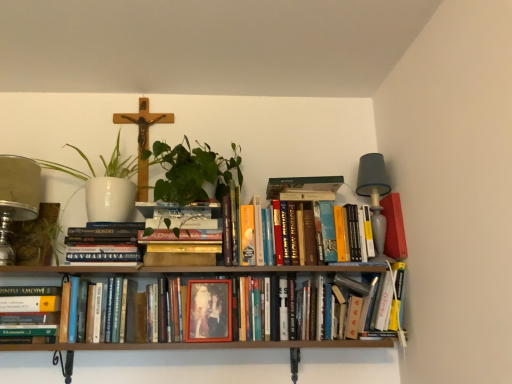
The image size is (512, 384). What do you see at coordinates (103, 242) in the screenshot? I see `hardcover books at center, the third book viewed from the right` at bounding box center [103, 242].

Where is `hardcover books at center, marked as the 2th book in a left-to-right arrangement`? The image size is (512, 384). hardcover books at center, marked as the 2th book in a left-to-right arrangement is located at coordinates (103, 242).

What do you see at coordinates (105, 185) in the screenshot?
I see `white ceramic pot at upper left` at bounding box center [105, 185].

This screenshot has height=384, width=512. What do you see at coordinates (375, 197) in the screenshot?
I see `gray fabric lampshade at upper right, marked as the 1th table lamp in a right-to-left arrangement` at bounding box center [375, 197].

Identify the location of metallic glass table lamp at left, the first table lamp from the left. This screenshot has height=384, width=512. (17, 198).

Where is `hardcover books at center, marked as the 2th book in a left-to-right arrangement`? The width and height of the screenshot is (512, 384). hardcover books at center, marked as the 2th book in a left-to-right arrangement is located at coordinates (103, 242).

From the image's perspective, is matte plastic photo frame at center, which is counted as the 2th paperback book, starting from the back, above gray fabric lampshade at upper right, marked as the 1th table lamp in a right-to-left arrangement?

No.

Is matte plastic photo frame at center, placed as the 1th paperback book when sorted from bottom to top, beside gray fabric lampshade at upper right, marked as the 1th table lamp in a right-to-left arrangement?

No.

Considering the sizes of objects matte plastic photo frame at center, marked as the 1th paperback book in a front-to-back arrangement, and gray fabric lampshade at upper right, marked as the 1th table lamp in a right-to-left arrangement, in the image provided, who is smaller, matte plastic photo frame at center, marked as the 1th paperback book in a front-to-back arrangement, or gray fabric lampshade at upper right, marked as the 1th table lamp in a right-to-left arrangement,?

matte plastic photo frame at center, marked as the 1th paperback book in a front-to-back arrangement.

Is matte plastic photo frame at center, placed as the first paperback book when sorted from left to right, oriented towards gray fabric lampshade at upper right, arranged as the 2th table lamp when viewed from the left?

No.

From the picture: Is hardcover book at lower left, acting as the 1th book starting from the left, with hardcover books at center, the third book viewed from the right?

They are not placed beside each other.

Can you confirm if hardcover book at lower left, acting as the 1th book starting from the left, is taller than hardcover books at center, marked as the 2th book in a left-to-right arrangement?

In fact, hardcover book at lower left, acting as the 1th book starting from the left, may be shorter than hardcover books at center, marked as the 2th book in a left-to-right arrangement.

From a real-world perspective, is hardcover book at lower left, acting as the fourth book starting from the right, above or below hardcover books at center, the third book viewed from the right?

From a real-world perspective, hardcover book at lower left, acting as the fourth book starting from the right, is physically below hardcover books at center, the third book viewed from the right.

Which is in front, wooden crucifix at upper center or matte red paperback book at right, the 1th paperback book viewed from the top?

Positioned in front is matte red paperback book at right, the 1th paperback book viewed from the top.

Is wooden crucifix at upper center shorter than matte red paperback book at right, which is the 2th paperback book in bottom-to-top order?

In fact, wooden crucifix at upper center may be taller than matte red paperback book at right, which is the 2th paperback book in bottom-to-top order.

Is point (172, 120) farther from viewer compared to point (404, 238)?

Yes, it is behind point (404, 238).

Find the location of a particular element. The height and width of the screenshot is (384, 512). the 1st paperback book directly beneath the wooden crucifix at upper center (from a real-world perspective) is located at coordinates (394, 227).

From the image's perspective, starting from the matte plastic photo frame at center, which ranks as the second paperback book in right-to-left order, which book is the 2nd one below? Please provide its 2D coordinates.

[(29, 314)]

Is matte plastic photo frame at center, the second paperback book viewed from the top, turned away from hardcover book at lower left, acting as the fourth book starting from the right?

No, hardcover book at lower left, acting as the fourth book starting from the right, is not at the back of matte plastic photo frame at center, the second paperback book viewed from the top.

From the image's perspective, between matte plastic photo frame at center, placed as the first paperback book when sorted from left to right, and hardcover book at lower left, acting as the fourth book starting from the right, who is located below?

hardcover book at lower left, acting as the fourth book starting from the right, from the image's perspective.

From a real-world perspective, which object rests below the other?

hardcover book at lower left, acting as the 1th book starting from the left.

Starting from the metallic glass table lamp at left, which ranks as the second table lamp in right-to-left order, which book is the 2nd one behind? Please provide its 2D coordinates.

[(252, 233)]

Is hardcover books at center, marked as the first book in a right-to-left arrangement, positioned far away from metallic glass table lamp at left, which ranks as the second table lamp in right-to-left order?

No, hardcover books at center, marked as the first book in a right-to-left arrangement, is not far away from metallic glass table lamp at left, which ranks as the second table lamp in right-to-left order.

Is hardcover books at center, which is the fourth book from left to right, facing away from metallic glass table lamp at left, the first table lamp from the left?

hardcover books at center, which is the fourth book from left to right, is not turned away from metallic glass table lamp at left, the first table lamp from the left.

Which is in front, point (392, 202) or point (19, 199)?

The point (19, 199) is closer to the camera.

Between matte red paperback book at right, acting as the first paperback book starting from the right, and metallic glass table lamp at left, the first table lamp from the left, which one has smaller size?

matte red paperback book at right, acting as the first paperback book starting from the right.

Is matte red paperback book at right, which ranks as the 1th paperback book in back-to-front order, turned away from metallic glass table lamp at left, which ranks as the second table lamp in right-to-left order?

No, matte red paperback book at right, which ranks as the 1th paperback book in back-to-front order, is not facing away from metallic glass table lamp at left, which ranks as the second table lamp in right-to-left order.

Considering the sizes of objects wooden crucifix at upper center and hardcover books at center, marked as the 2th book in a left-to-right arrangement, in the image provided, who is bigger, wooden crucifix at upper center or hardcover books at center, marked as the 2th book in a left-to-right arrangement,?

hardcover books at center, marked as the 2th book in a left-to-right arrangement, is bigger.

From the picture: Is wooden crucifix at upper center oriented away from hardcover books at center, marked as the 2th book in a left-to-right arrangement?

wooden crucifix at upper center does not have its back to hardcover books at center, marked as the 2th book in a left-to-right arrangement.

Considering the positions of objects wooden crucifix at upper center and hardcover books at center, the third book viewed from the right, in the image provided, who is more to the right, wooden crucifix at upper center or hardcover books at center, the third book viewed from the right,?

Positioned to the right is wooden crucifix at upper center.

Who is taller, wooden crucifix at upper center or hardcover books at center, marked as the 2th book in a left-to-right arrangement?

With more height is wooden crucifix at upper center.

In order to click on table lamp located behind the matte plastic photo frame at center, the second paperback book viewed from the top in this screenshot , I will do `click(375, 197)`.

Locate an element on the screen. This screenshot has width=512, height=384. the 2nd book below when counting from the hardcover books at center, marked as the 2th book in a left-to-right arrangement (from the image's perspective) is located at coordinates (29, 314).

Which object lies further to the anchor point hardcover book at lower left, acting as the fourth book starting from the right, hardcover books at center, marked as the 2th book in a left-to-right arrangement, or wooden frame photo at center, arranged as the second book when viewed from the right?

wooden frame photo at center, arranged as the second book when viewed from the right.

Which object lies nearer to the anchor point hardcover book at lower left, acting as the 1th book starting from the left, metallic glass table lamp at left, the first table lamp from the left, or matte plastic photo frame at center, placed as the first paperback book when sorted from left to right?

The object closer to hardcover book at lower left, acting as the 1th book starting from the left, is metallic glass table lamp at left, the first table lamp from the left.

From the image, which object appears to be farther from matte plastic photo frame at center, which ranks as the second paperback book in right-to-left order, matte red paperback book at right, the 2th paperback book from the front, or wooden frame photo at center, arranged as the second book when viewed from the right?

The object further to matte plastic photo frame at center, which ranks as the second paperback book in right-to-left order, is matte red paperback book at right, the 2th paperback book from the front.

Estimate the real-world distances between objects in this image. Which object is closer to white ceramic pot at upper left, matte red paperback book at right, the 2th paperback book from the front, or metallic glass table lamp at left, which ranks as the second table lamp in right-to-left order?

metallic glass table lamp at left, which ranks as the second table lamp in right-to-left order, is closer to white ceramic pot at upper left.

Estimate the real-world distances between objects in this image. Which object is further from matte red paperback book at right, which ranks as the 1th paperback book in back-to-front order, hardcover books at center, the third book viewed from the right, or hardcover books at center, which is the fourth book from left to right?

hardcover books at center, the third book viewed from the right, lies further to matte red paperback book at right, which ranks as the 1th paperback book in back-to-front order, than the other object.

When comparing their distances from white ceramic pot at upper left, does hardcover books at center, marked as the first book in a right-to-left arrangement, or gray fabric lampshade at upper right, marked as the 1th table lamp in a right-to-left arrangement, seem further?

gray fabric lampshade at upper right, marked as the 1th table lamp in a right-to-left arrangement, is positioned further to the anchor white ceramic pot at upper left.

From the image, which object appears to be nearer to hardcover books at center, which is the fourth book from left to right, matte red paperback book at right, which is the 2th paperback book in bottom-to-top order, or hardcover books at center, the third book viewed from the right?

matte red paperback book at right, which is the 2th paperback book in bottom-to-top order, is closer to hardcover books at center, which is the fourth book from left to right.

From the image, which object appears to be nearer to hardcover books at center, marked as the 2th book in a left-to-right arrangement, metallic glass table lamp at left, which ranks as the second table lamp in right-to-left order, or white ceramic pot at upper left?

white ceramic pot at upper left.

At what (x,y) coordinates should I click in order to perform the action: click on crucifix between hardcover books at center, the third book viewed from the right, and matte red paperback book at right, which ranks as the 1th paperback book in back-to-front order, from left to right. Please return your answer as a coordinate pair (x, y). Looking at the image, I should click on (143, 139).

Find the location of `crucifix between hardcover books at center, the third book viewed from the right, and gray fabric lampshade at upper right, arranged as the 2th table lamp when viewed from the left, in the horizontal direction`. crucifix between hardcover books at center, the third book viewed from the right, and gray fabric lampshade at upper right, arranged as the 2th table lamp when viewed from the left, in the horizontal direction is located at coordinates (143, 139).

Identify the location of crucifix located between metallic glass table lamp at left, which ranks as the second table lamp in right-to-left order, and matte plastic photo frame at center, which is counted as the 2th paperback book, starting from the back, in the left-right direction. (143, 139).

Find the location of a particular element. This screenshot has width=512, height=384. houseplant between hardcover book at lower left, acting as the 1th book starting from the left, and matte plastic photo frame at center, marked as the 1th paperback book in a front-to-back arrangement, in the horizontal direction is located at coordinates (105, 185).